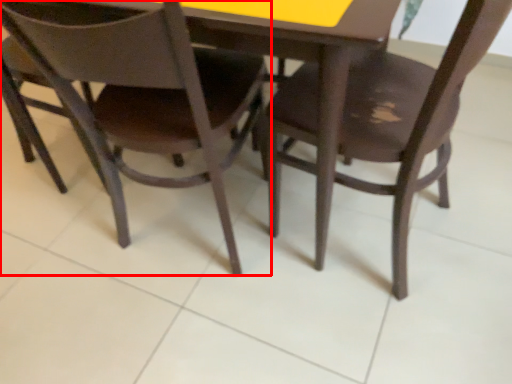
Question: From the image's perspective, where is chair (annotated by the red box) located in relation to chair in the image?

Choices:
 (A) above
 (B) below

Answer: (A)